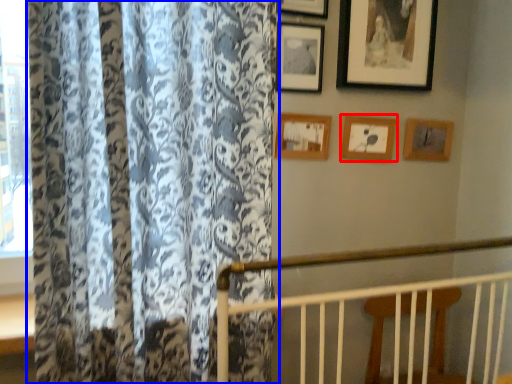
Question: Which of the following is the farthest to the observer, picture frame (highlighted by a red box) or curtain (highlighted by a blue box)?

Choices:
 (A) picture frame
 (B) curtain

Answer: (A)